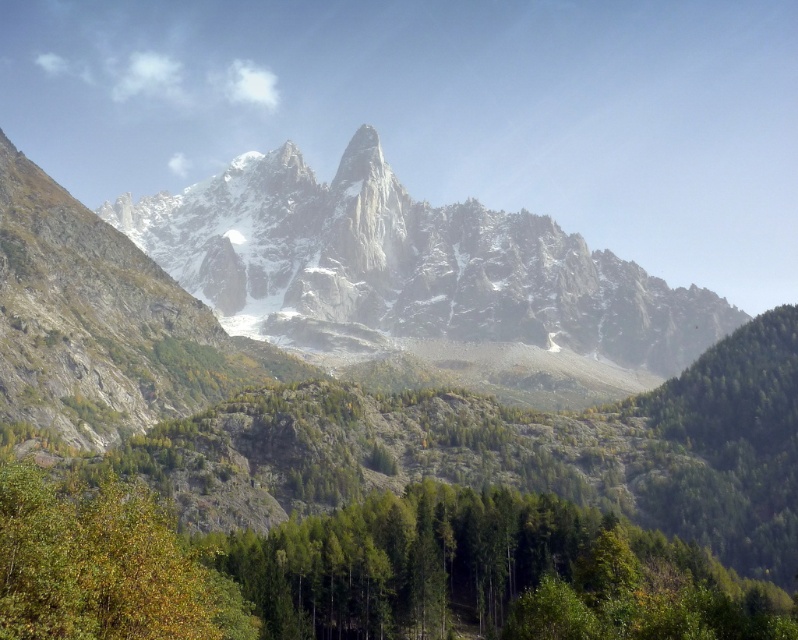
Is white rocky mountain range at center below green leafy tree at lower left?

No, white rocky mountain range at center is not below green leafy tree at lower left.

Does white rocky mountain range at center have a lesser height compared to green leafy tree at lower left?

No, white rocky mountain range at center is not shorter than green leafy tree at lower left.

Who is more forward, (488,268) or (113,550)?

Point (113,550) is more forward.

I want to click on white rocky mountain range at center, so click(x=405, y=266).